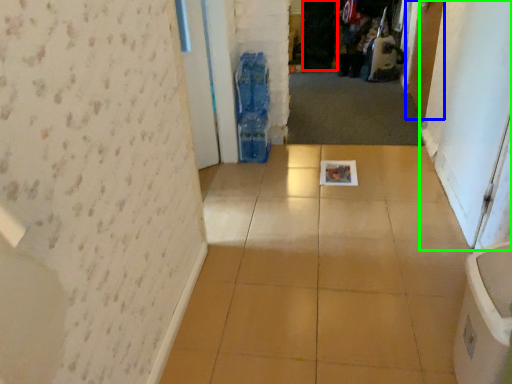
Question: Which object is the farthest from screen door (highlighted by a red box)? Choose among these: door (highlighted by a blue box) or screen door (highlighted by a green box).

Choices:
 (A) door
 (B) screen door

Answer: (B)